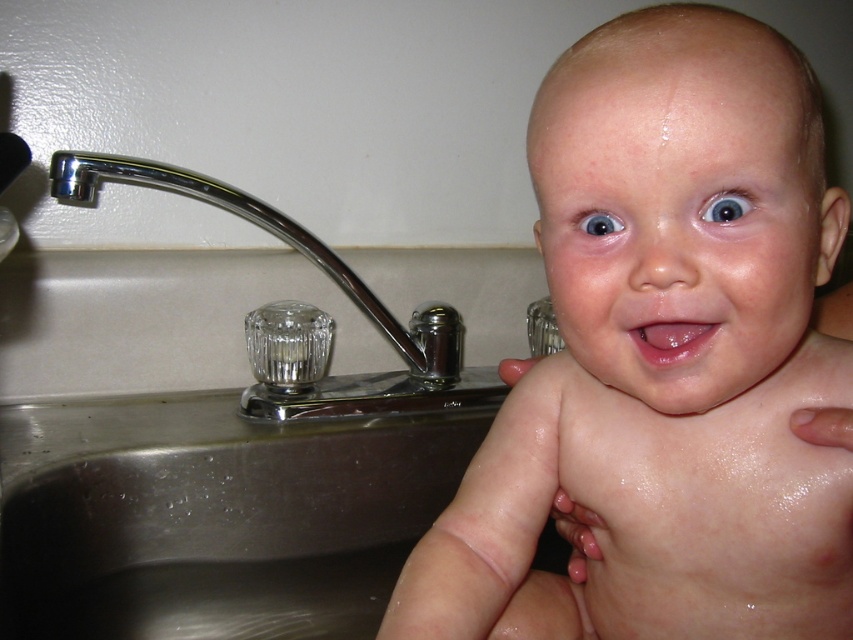
From the picture: Can you confirm if silver metallic sink at left is shorter than chrome/metallic faucet at left?

Incorrect, silver metallic sink at left's height does not fall short of chrome/metallic faucet at left's.

Is silver metallic sink at left bigger than chrome/metallic faucet at left?

Correct, silver metallic sink at left is larger in size than chrome/metallic faucet at left.

Is point (216, 257) positioned in front of point (196, 188)?

No, it is behind (196, 188).

Identify the location of silver metallic sink at left. (202, 454).

Is point (828, 480) farther from camera compared to point (146, 182)?

That is False.

Based on the photo, how distant is glossy skin baby at center from chrome/metallic faucet at left?

19.03 inches

Between point (769, 557) and point (148, 164), which one is positioned behind?

The point (148, 164) is behind.

This screenshot has height=640, width=853. In order to click on glossy skin baby at center in this screenshot , I will do `click(664, 356)`.

Which of these two, glossy skin baby at center or silver metallic sink at left, stands shorter?

glossy skin baby at center

Is the position of glossy skin baby at center more distant than that of silver metallic sink at left?

No, glossy skin baby at center is in front of silver metallic sink at left.

In order to click on glossy skin baby at center in this screenshot , I will do `click(664, 356)`.